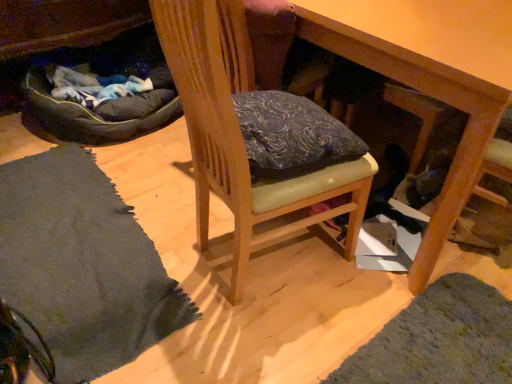
Question: Considering the positions of point (78, 276) and point (502, 96), is point (78, 276) closer or farther from the camera than point (502, 96)?

Choices:
 (A) closer
 (B) farther

Answer: (B)

Question: Considering the positions of soft gray rug at lower left and wooden table at center in the image, is soft gray rug at lower left wider or thinner than wooden table at center?

Choices:
 (A) wide
 (B) thin

Answer: (B)

Question: Based on their relative distances, which object is nearer to the dark gray fabric bean bag at left?

Choices:
 (A) wooden table at center
 (B) soft gray rug at lower left
 (C) wooden chair at center

Answer: (B)

Question: Which of these objects is positioned closest to the wooden table at center?

Choices:
 (A) wooden chair at center
 (B) dark gray fabric bean bag at left
 (C) soft gray rug at lower left

Answer: (A)